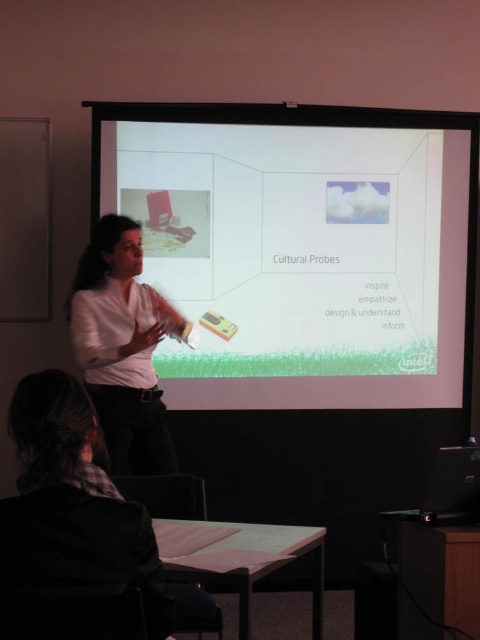
You are attending a presentation and notice the white glossy projector screen at upper center and the white matte shirt at center. Which object is positioned higher in the image?

The white glossy projector screen at upper center is positioned higher than the white matte shirt at center.